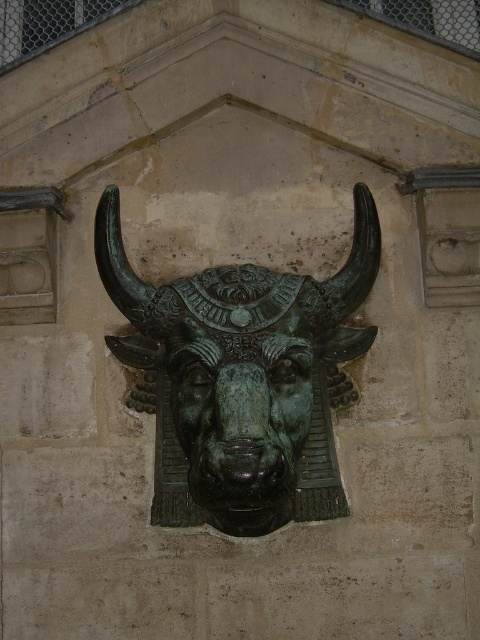
You are an art conservator examining the bronze sculpture. You notice two parts labeled as the green patina bull at center and the green patina bull head at center. Which part is positioned closer to the viewer?

The green patina bull at center is closer to the viewer because the green patina bull head at center is behind it.